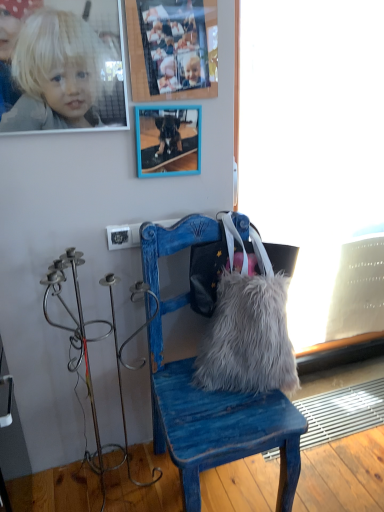
Question: Could you tell me if blonde hair at upper left is facing frosted glass window screen at right?

Choices:
 (A) yes
 (B) no

Answer: (B)

Question: From the image's perspective, is blonde hair at upper left beneath frosted glass window screen at right?

Choices:
 (A) no
 (B) yes

Answer: (A)

Question: From a real-world perspective, does blonde hair at upper left stand above frosted glass window screen at right?

Choices:
 (A) no
 (B) yes

Answer: (B)

Question: Is blonde hair at upper left wider than frosted glass window screen at right?

Choices:
 (A) no
 (B) yes

Answer: (A)

Question: Considering the relative sizes of blonde hair at upper left and frosted glass window screen at right in the image provided, is blonde hair at upper left shorter than frosted glass window screen at right?

Choices:
 (A) yes
 (B) no

Answer: (A)

Question: Is blue wooden picture frame at upper center, the 2th picture frame viewed from the top, in front of or behind wooden photo frame at upper center, which appears as the second picture frame when ordered from the bottom, in the image?

Choices:
 (A) front
 (B) behind

Answer: (B)

Question: Considering the positions of blue wooden picture frame at upper center, the first picture frame when ordered from bottom to top, and wooden photo frame at upper center, which appears as the second picture frame when ordered from the bottom, in the image, is blue wooden picture frame at upper center, the first picture frame when ordered from bottom to top, taller or shorter than wooden photo frame at upper center, which appears as the second picture frame when ordered from the bottom,?

Choices:
 (A) short
 (B) tall

Answer: (A)

Question: In terms of size, does blue wooden picture frame at upper center, the 2th picture frame viewed from the top, appear bigger or smaller than wooden photo frame at upper center, which appears as the second picture frame when ordered from the bottom?

Choices:
 (A) big
 (B) small

Answer: (B)

Question: Considering the positions of blue wooden picture frame at upper center, the 2th picture frame viewed from the top, and wooden photo frame at upper center, which appears as the second picture frame when ordered from the bottom, in the image, is blue wooden picture frame at upper center, the 2th picture frame viewed from the top, wider or thinner than wooden photo frame at upper center, which appears as the second picture frame when ordered from the bottom,?

Choices:
 (A) thin
 (B) wide

Answer: (B)

Question: From a real-world perspective, relative to blue wooden chair at center, is wooden photo frame at upper center, which appears as the second picture frame when ordered from the bottom, vertically above or below?

Choices:
 (A) below
 (B) above

Answer: (B)

Question: From the image's perspective, relative to blue wooden chair at center, is wooden photo frame at upper center, placed as the 1th picture frame when sorted from top to bottom, above or below?

Choices:
 (A) below
 (B) above

Answer: (B)

Question: Considering the positions of wooden photo frame at upper center, placed as the 1th picture frame when sorted from top to bottom, and blue wooden chair at center in the image, is wooden photo frame at upper center, placed as the 1th picture frame when sorted from top to bottom, taller or shorter than blue wooden chair at center?

Choices:
 (A) short
 (B) tall

Answer: (A)

Question: Considering the positions of wooden photo frame at upper center, which appears as the second picture frame when ordered from the bottom, and blue wooden chair at center in the image, is wooden photo frame at upper center, which appears as the second picture frame when ordered from the bottom, wider or thinner than blue wooden chair at center?

Choices:
 (A) thin
 (B) wide

Answer: (A)

Question: Is point (165, 38) positioned closer to the camera than point (284, 18)?

Choices:
 (A) closer
 (B) farther

Answer: (A)

Question: In the image, is wooden photo frame at upper center, placed as the 1th picture frame when sorted from top to bottom, positioned in front of or behind frosted glass window screen at right?

Choices:
 (A) behind
 (B) front

Answer: (B)